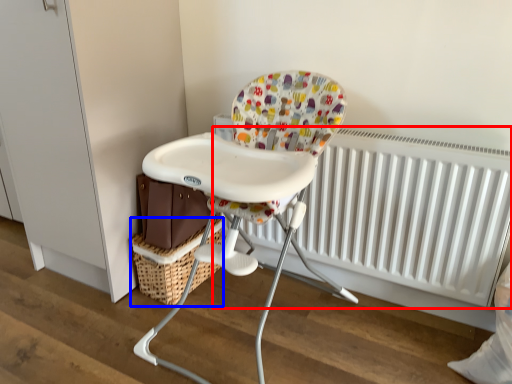
Question: Which object is further to the camera taking this photo, radiator (highlighted by a red box) or basket (highlighted by a blue box)?

Choices:
 (A) radiator
 (B) basket

Answer: (B)